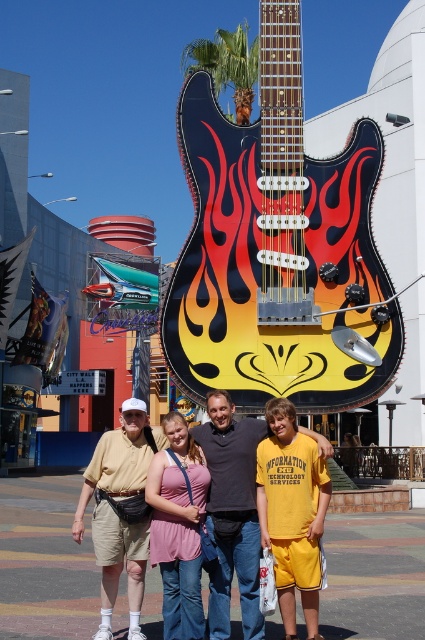
Does point (370, 324) come behind point (121, 531)?

That is True.

Between flame-painted wood guitar at center and matte khaki shorts at center, which one appears on the left side from the viewer's perspective?

matte khaki shorts at center is more to the left.

You are a GUI agent. You are given a task and a screenshot of the screen. Output one action in this format:
    pyautogui.click(x=<x>, y=<y>)
    Task: Click on the flame-painted wood guitar at center
    This screenshot has width=425, height=640.
    Given the screenshot: What is the action you would take?
    pyautogui.click(x=278, y=248)

The width and height of the screenshot is (425, 640). In order to click on flame-painted wood guitar at center in this screenshot , I will do `click(278, 248)`.

Is point (110, 493) more distant than point (159, 454)?

No, it is in front of (159, 454).

Does point (79, 499) lie in front of point (187, 429)?

That is False.

I want to click on matte khaki shorts at center, so click(x=119, y=509).

This screenshot has width=425, height=640. What do you see at coordinates (278, 248) in the screenshot? I see `flame-painted wood guitar at center` at bounding box center [278, 248].

Which is more to the left, flame-painted wood guitar at center or matte yellow shorts at center?

matte yellow shorts at center is more to the left.

Measure the distance between point (x=351, y=358) and camera.

Point (x=351, y=358) and camera are 208.30 feet apart.

This screenshot has height=640, width=425. Find the location of `flame-painted wood guitar at center`. flame-painted wood guitar at center is located at coordinates (278, 248).